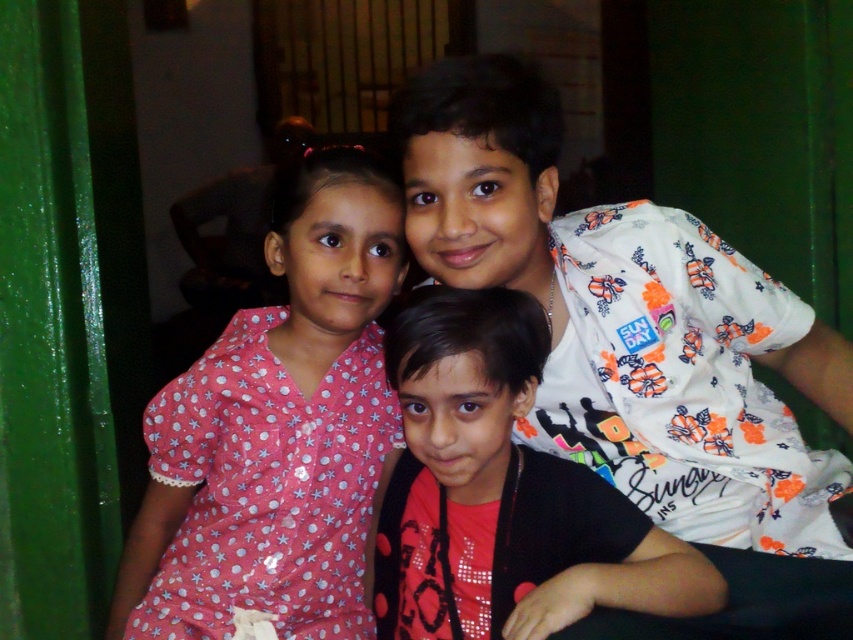
Does point (370, 268) lie in front of point (479, 552)?

No, (370, 268) is behind (479, 552).

Is pink dotted dress at left in front of matte floral shirt at center?

No, pink dotted dress at left is behind matte floral shirt at center.

At what (x,y) coordinates should I click in order to perform the action: click on pink dotted dress at left. Please return your answer as a coordinate pair (x, y). Looking at the image, I should click on (277, 429).

Which is more to the left, white floral shirt at upper right or pink dotted dress at left?

pink dotted dress at left

Locate an element on the screen. The width and height of the screenshot is (853, 640). white floral shirt at upper right is located at coordinates (627, 320).

Who is more forward, (500, 54) or (271, 228)?

Point (271, 228) is more forward.

You are a GUI agent. You are given a task and a screenshot of the screen. Output one action in this format:
    pyautogui.click(x=<x>, y=<y>)
    Task: Click on the white floral shirt at upper right
    The image size is (853, 640).
    Given the screenshot: What is the action you would take?
    pyautogui.click(x=627, y=320)

Who is shorter, white floral shirt at upper right or matte floral shirt at center?

With less height is matte floral shirt at center.

Does white floral shirt at upper right come in front of matte floral shirt at center?

No, white floral shirt at upper right is behind matte floral shirt at center.

Who is more forward, (798, 493) or (445, 452)?

Positioned in front is point (445, 452).

Locate an element on the screen. Image resolution: width=853 pixels, height=640 pixels. white floral shirt at upper right is located at coordinates (627, 320).